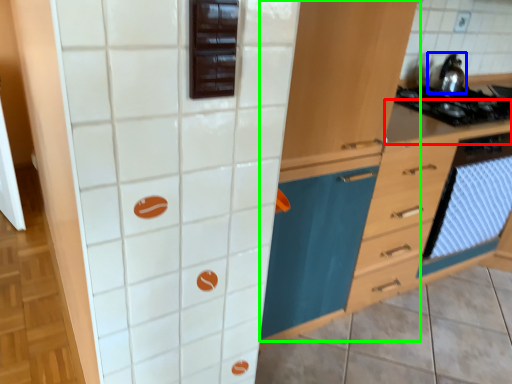
Question: Estimate the real-world distances between objects in this image. Which object is closer to counter top (highlighted by a red box), kitchen appliance (highlighted by a blue box) or cabinetry (highlighted by a green box)?

Choices:
 (A) kitchen appliance
 (B) cabinetry

Answer: (A)